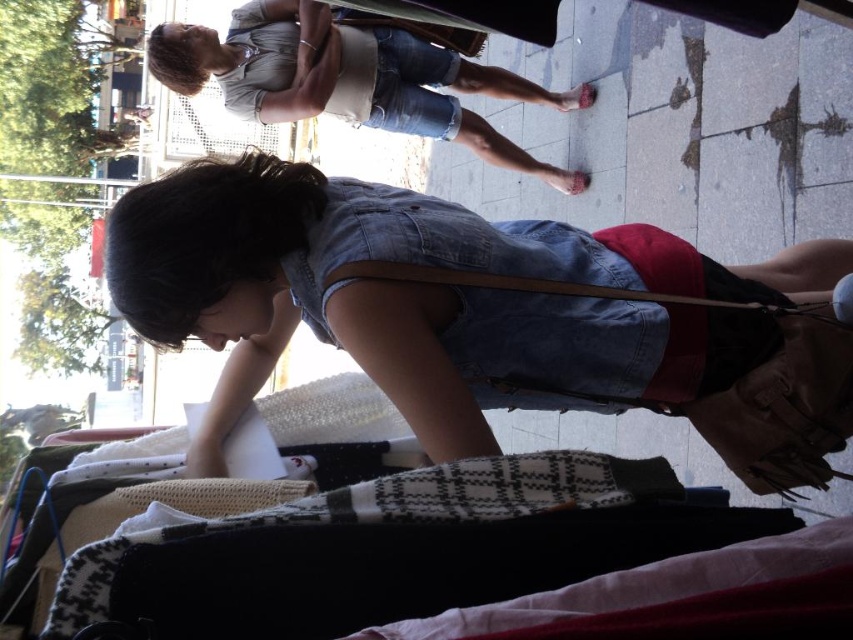
Based on the rotated image, if you are facing the scene as shown, which of the two points, point (741, 465) or point (381, 61), is closer to you?

Point (741, 465) is in front of point (381, 61), so it is closer to you.

Based on the rotated image, where is the denim dress at center located in terms of coordinates?

The denim dress at center is located at coordinates point (486,312).